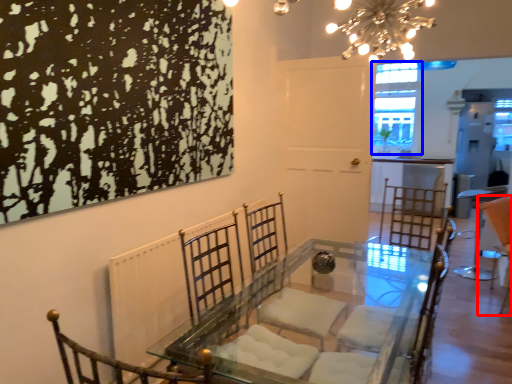
Question: Which of the following is the farthest to the observer, swivel chair (highlighted by a red box) or window (highlighted by a blue box)?

Choices:
 (A) swivel chair
 (B) window

Answer: (B)